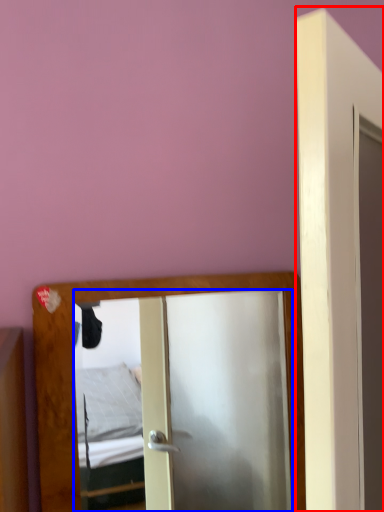
Question: Which object is further to the camera taking this photo, door (highlighted by a red box) or mirror (highlighted by a blue box)?

Choices:
 (A) door
 (B) mirror

Answer: (B)